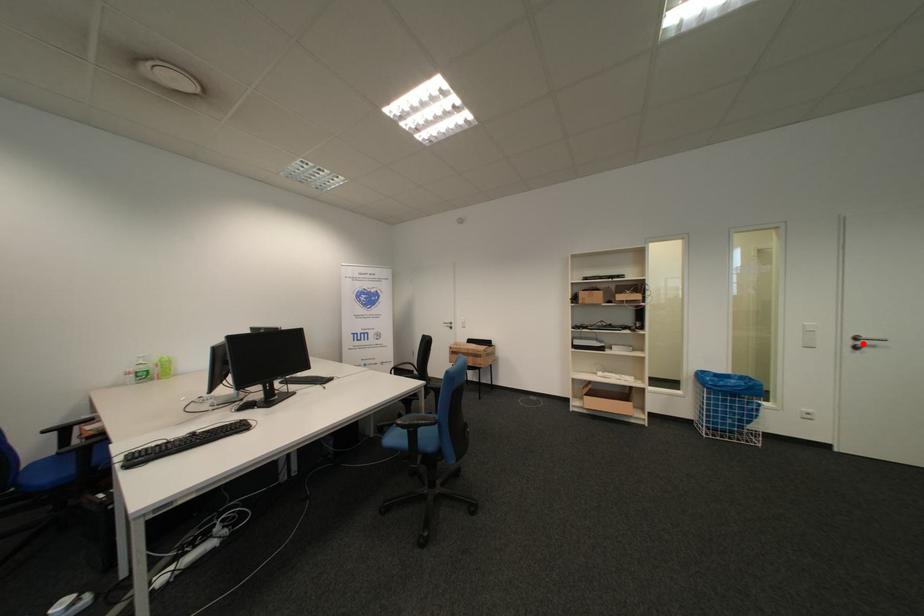
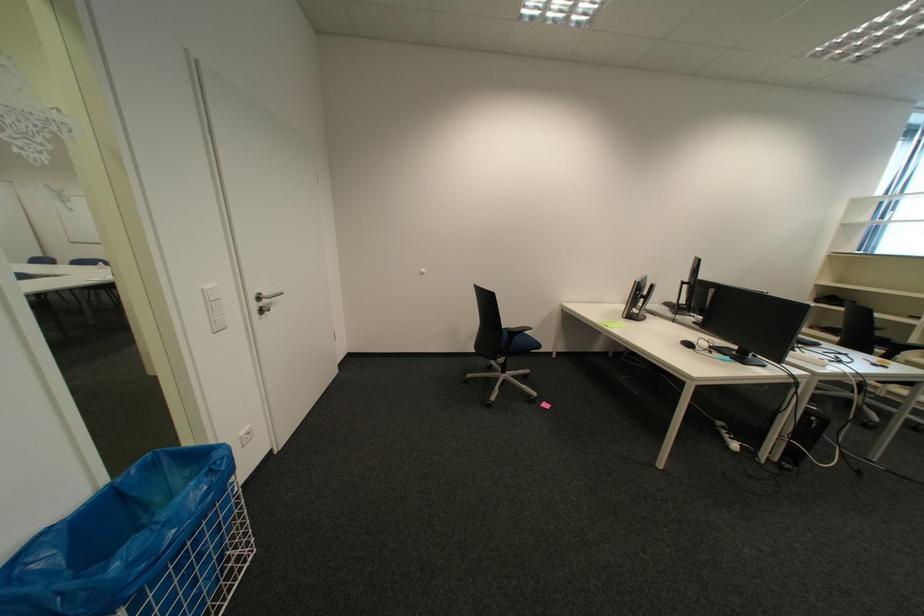
Where in the second image is the point corresponding to the highlighted location from the first image?

(266, 307)